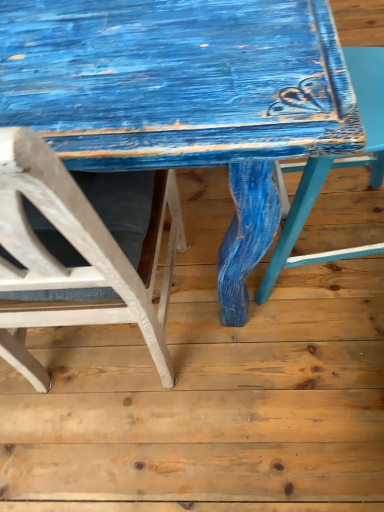
Measure the distance between point (175,136) and camera.

The distance of point (175,136) from camera is 18.74 inches.

Find the location of a particular element. Image resolution: width=384 pixels, height=512 pixels. white matte chair at left, placed as the first chair when sorted from left to right is located at coordinates (78, 251).

Where is `matte blue chair at right, which is the first chair in right-to-left order`? This screenshot has height=512, width=384. matte blue chair at right, which is the first chair in right-to-left order is located at coordinates (333, 167).

Is matte blue chair at right, which is the 2th chair from left to right, closer to the viewer compared to distressed blue wood table at center?

Yes.

Considering the relative positions of matte blue chair at right, which is the first chair in right-to-left order, and distressed blue wood table at center in the image provided, is matte blue chair at right, which is the first chair in right-to-left order, to the right of distressed blue wood table at center from the viewer's perspective?

Correct, you'll find matte blue chair at right, which is the first chair in right-to-left order, to the right of distressed blue wood table at center.

How many degrees apart are the facing directions of matte blue chair at right, which is the first chair in right-to-left order, and distressed blue wood table at center?

There is a 92.9-degree angle between the facing directions of matte blue chair at right, which is the first chair in right-to-left order, and distressed blue wood table at center.

Considering the sizes of objects matte blue chair at right, which is the 2th chair from left to right, and distressed blue wood table at center in the image provided, who is smaller, matte blue chair at right, which is the 2th chair from left to right, or distressed blue wood table at center?

Smaller between the two is matte blue chair at right, which is the 2th chair from left to right.

In the image, is white matte chair at left, placed as the first chair when sorted from left to right, positioned in front of or behind distressed blue wood table at center?

white matte chair at left, placed as the first chair when sorted from left to right, is positioned closer to the viewer than distressed blue wood table at center.

How different are the orientations of white matte chair at left, placed as the second chair when sorted from right to left, and distressed blue wood table at center in degrees?

The facing directions of white matte chair at left, placed as the second chair when sorted from right to left, and distressed blue wood table at center are 0.604 degrees apart.

Between point (65, 234) and point (252, 94), which one is positioned in front?

Point (65, 234)

From the image's perspective, relative to distressed blue wood table at center, is white matte chair at left, placed as the second chair when sorted from right to left, above or below?

white matte chair at left, placed as the second chair when sorted from right to left, is situated lower than distressed blue wood table at center in the image.

From the image's perspective, relative to matte blue chair at right, which is the first chair in right-to-left order, is white matte chair at left, placed as the second chair when sorted from right to left, above or below?

Clearly, from the image's perspective, white matte chair at left, placed as the second chair when sorted from right to left, is below matte blue chair at right, which is the first chair in right-to-left order.

Choose the correct answer: Is white matte chair at left, placed as the second chair when sorted from right to left, inside matte blue chair at right, which is the 2th chair from left to right, or outside it?

The correct answer is: outside.

Is the position of white matte chair at left, placed as the second chair when sorted from right to left, more distant than that of matte blue chair at right, which is the 2th chair from left to right?

No, white matte chair at left, placed as the second chair when sorted from right to left, is in front of matte blue chair at right, which is the 2th chair from left to right.

Considering the sizes of objects white matte chair at left, placed as the second chair when sorted from right to left, and matte blue chair at right, which is the 2th chair from left to right, in the image provided, who is thinner, white matte chair at left, placed as the second chair when sorted from right to left, or matte blue chair at right, which is the 2th chair from left to right,?

With smaller width is matte blue chair at right, which is the 2th chair from left to right.

From a real-world perspective, is distressed blue wood table at center positioned above or below white matte chair at left, placed as the first chair when sorted from left to right?

distressed blue wood table at center is below white matte chair at left, placed as the first chair when sorted from left to right.

Does point (315, 41) come in front of point (168, 192)?

Yes, point (315, 41) is in front of point (168, 192).

Is distressed blue wood table at center not inside white matte chair at left, placed as the second chair when sorted from right to left?

Absolutely, distressed blue wood table at center is external to white matte chair at left, placed as the second chair when sorted from right to left.

Does distressed blue wood table at center have a greater width compared to matte blue chair at right, which is the first chair in right-to-left order?

Correct, the width of distressed blue wood table at center exceeds that of matte blue chair at right, which is the first chair in right-to-left order.

Between distressed blue wood table at center and matte blue chair at right, which is the 2th chair from left to right, which one appears on the right side from the viewer's perspective?

matte blue chair at right, which is the 2th chair from left to right.

Considering the relative sizes of distressed blue wood table at center and matte blue chair at right, which is the first chair in right-to-left order, in the image provided, is distressed blue wood table at center taller than matte blue chair at right, which is the first chair in right-to-left order,?

In fact, distressed blue wood table at center may be shorter than matte blue chair at right, which is the first chair in right-to-left order.

How many degrees apart are the facing directions of distressed blue wood table at center and matte blue chair at right, which is the 2th chair from left to right?

92.9 degrees separate the facing orientations of distressed blue wood table at center and matte blue chair at right, which is the 2th chair from left to right.

Are matte blue chair at right, which is the first chair in right-to-left order, and white matte chair at left, placed as the second chair when sorted from right to left, far apart?

matte blue chair at right, which is the first chair in right-to-left order, is actually quite close to white matte chair at left, placed as the second chair when sorted from right to left.

How different are the orientations of matte blue chair at right, which is the first chair in right-to-left order, and white matte chair at left, placed as the first chair when sorted from left to right, in degrees?

They differ by 92.3 degrees in their facing directions.

Who is more distant, matte blue chair at right, which is the 2th chair from left to right, or white matte chair at left, placed as the second chair when sorted from right to left?

matte blue chair at right, which is the 2th chair from left to right, is behind.

Is white matte chair at left, placed as the second chair when sorted from right to left, at the back of matte blue chair at right, which is the 2th chair from left to right?

matte blue chair at right, which is the 2th chair from left to right, does not have its back to white matte chair at left, placed as the second chair when sorted from right to left.

Where is `chair on the right of distressed blue wood table at center`? The height and width of the screenshot is (512, 384). chair on the right of distressed blue wood table at center is located at coordinates (333, 167).

This screenshot has height=512, width=384. What are the coordinates of `table below the white matte chair at left, placed as the second chair when sorted from right to left (from a real-world perspective)` in the screenshot? It's located at (184, 97).

Looking at the image, which one is located closer to white matte chair at left, placed as the second chair when sorted from right to left, matte blue chair at right, which is the first chair in right-to-left order, or distressed blue wood table at center?

The object closer to white matte chair at left, placed as the second chair when sorted from right to left, is distressed blue wood table at center.

Based on their spatial positions, is distressed blue wood table at center or white matte chair at left, placed as the first chair when sorted from left to right, closer to matte blue chair at right, which is the 2th chair from left to right?

The object closer to matte blue chair at right, which is the 2th chair from left to right, is distressed blue wood table at center.

Estimate the real-world distances between objects in this image. Which object is further from distressed blue wood table at center, matte blue chair at right, which is the first chair in right-to-left order, or white matte chair at left, placed as the second chair when sorted from right to left?

The object further to distressed blue wood table at center is matte blue chair at right, which is the first chair in right-to-left order.

Considering their positions, is distressed blue wood table at center positioned closer to white matte chair at left, placed as the first chair when sorted from left to right, than matte blue chair at right, which is the first chair in right-to-left order?

distressed blue wood table at center.

When comparing their distances from distressed blue wood table at center, does white matte chair at left, placed as the first chair when sorted from left to right, or matte blue chair at right, which is the 2th chair from left to right, seem further?

Among the two, matte blue chair at right, which is the 2th chair from left to right, is located further to distressed blue wood table at center.

In the scene shown: Estimate the real-world distances between objects in this image. Which object is further from matte blue chair at right, which is the first chair in right-to-left order, white matte chair at left, placed as the first chair when sorted from left to right, or distressed blue wood table at center?

Among the two, white matte chair at left, placed as the first chair when sorted from left to right, is located further to matte blue chair at right, which is the first chair in right-to-left order.

Where is `table located between white matte chair at left, placed as the first chair when sorted from left to right, and matte blue chair at right, which is the first chair in right-to-left order, in the left-right direction`? The width and height of the screenshot is (384, 512). table located between white matte chair at left, placed as the first chair when sorted from left to right, and matte blue chair at right, which is the first chair in right-to-left order, in the left-right direction is located at coordinates (184, 97).